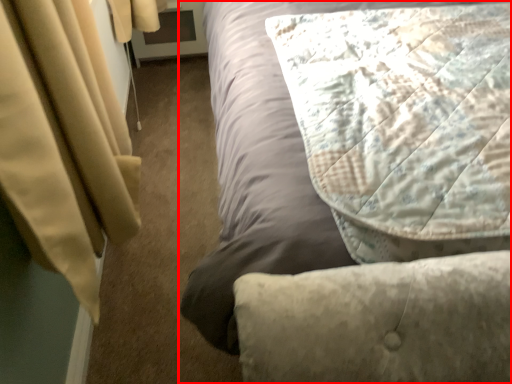
Question: From the image's perspective, what is the correct spatial positioning of bed (annotated by the red box) in reference to pillow?

Choices:
 (A) above
 (B) below

Answer: (A)